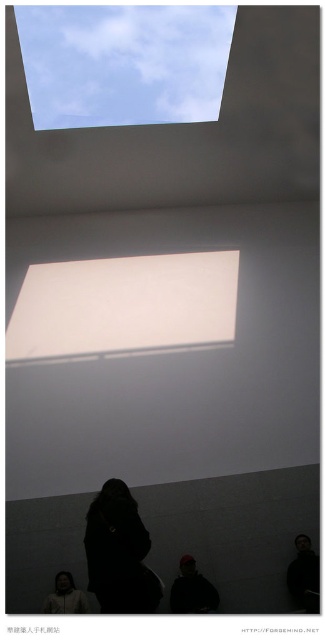
You are standing in the room and notice a point marked at coordinates (124,61). Based on the scene description, what object is this point located on?

The point is located on the transparent glass window at upper center.

You are an architect designing a new office space. You need to ensure that the transparent glass window at upper center and the black matte person at lower center are positioned in a way that the window is wider than the person. Based on the scene description, does the current arrangement meet this requirement?

The transparent glass window at upper center is wider than the black matte person at lower center, so the current arrangement meets the requirement.